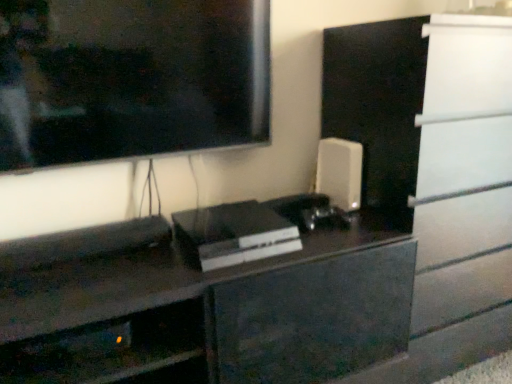
Question: Does white matte speaker at right, which appears as the 1th appliance when viewed from the right, have a smaller size compared to metallic gray shelf at lower left?

Choices:
 (A) yes
 (B) no

Answer: (A)

Question: Is white matte speaker at right, marked as the second appliance in a left-to-right arrangement, taller than metallic gray shelf at lower left?

Choices:
 (A) no
 (B) yes

Answer: (B)

Question: Can you confirm if white matte speaker at right, which appears as the 1th appliance when viewed from the right, is positioned to the right of metallic gray shelf at lower left?

Choices:
 (A) yes
 (B) no

Answer: (A)

Question: Is white matte speaker at right, which appears as the 1th appliance when viewed from the right, positioned before metallic gray shelf at lower left?

Choices:
 (A) no
 (B) yes

Answer: (A)

Question: Can we say white matte speaker at right, which is counted as the 2th appliance, starting from the front, lies outside metallic gray shelf at lower left?

Choices:
 (A) yes
 (B) no

Answer: (A)

Question: Considering the positions of point (202, 264) and point (88, 362), is point (202, 264) closer or farther from the camera than point (88, 362)?

Choices:
 (A) farther
 (B) closer

Answer: (A)

Question: Do you think sleek black console at center, which appears as the 2th appliance when viewed from the back, is within metallic gray shelf at lower left, or outside of it?

Choices:
 (A) outside
 (B) inside

Answer: (A)

Question: From a real-world perspective, relative to metallic gray shelf at lower left, is sleek black console at center, which appears as the 2th appliance when viewed from the back, vertically above or below?

Choices:
 (A) above
 (B) below

Answer: (A)

Question: In terms of size, does sleek black console at center, the first appliance positioned from the front, appear bigger or smaller than metallic gray shelf at lower left?

Choices:
 (A) small
 (B) big

Answer: (B)

Question: Is point (215, 246) closer or farther from the camera than point (344, 201)?

Choices:
 (A) farther
 (B) closer

Answer: (B)

Question: Is sleek black console at center, the 2th appliance in the right-to-left sequence, to the left or to the right of white matte speaker at right, marked as the second appliance in a left-to-right arrangement, in the image?

Choices:
 (A) right
 (B) left

Answer: (B)

Question: From the image's perspective, is sleek black console at center, which appears as the 2th appliance when viewed from the back, above or below white matte speaker at right, which is counted as the 2th appliance, starting from the front?

Choices:
 (A) above
 (B) below

Answer: (B)

Question: Is sleek black console at center, which appears as the 2th appliance when viewed from the back, inside the boundaries of white matte speaker at right, which is counted as the 2th appliance, starting from the front, or outside?

Choices:
 (A) inside
 (B) outside

Answer: (B)

Question: Is point (333, 180) closer or farther from the camera than point (242, 241)?

Choices:
 (A) farther
 (B) closer

Answer: (A)

Question: Considering the relative positions of white matte speaker at right, which is counted as the 2th appliance, starting from the front, and sleek black console at center, the first appliance positioned from the front, in the image provided, is white matte speaker at right, which is counted as the 2th appliance, starting from the front, to the left or to the right of sleek black console at center, the first appliance positioned from the front,?

Choices:
 (A) right
 (B) left

Answer: (A)